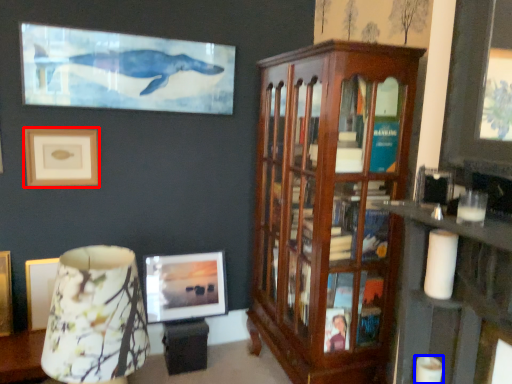
Question: Which object is further to the camera taking this photo, picture frame (highlighted by a red box) or candle (highlighted by a blue box)?

Choices:
 (A) picture frame
 (B) candle

Answer: (A)